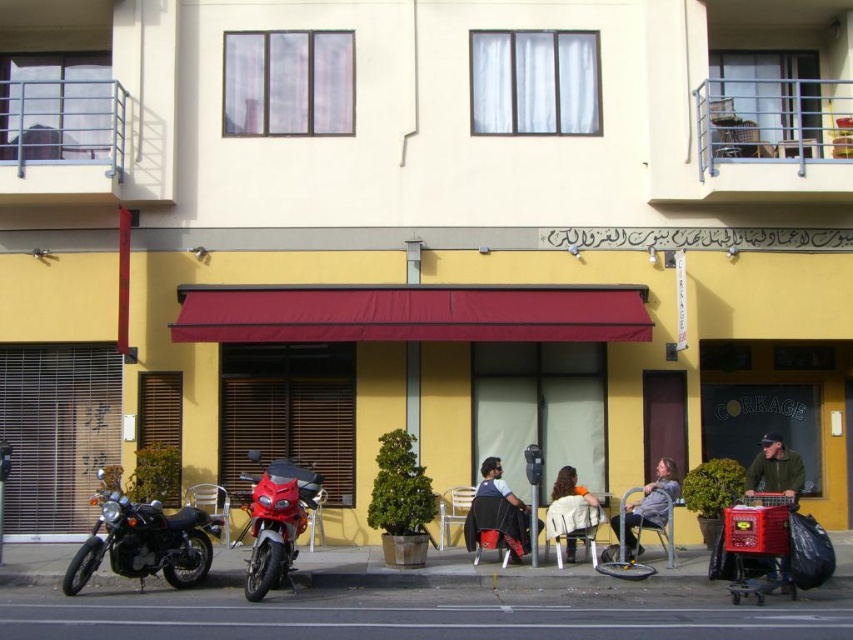
Question: Which point is closer to the camera?

Choices:
 (A) shiny red motorcycle at lower left
 (B) light brown leather jacket at center
 (C) matte black jacket at center
 (D) black matte motorcycle at lower left

Answer: (A)

Question: Which point is farther from the camera taking this photo?

Choices:
 (A) (170, 556)
 (B) (592, 528)
 (C) (468, 545)
 (D) (659, 506)

Answer: (D)

Question: Where is black matte motorcycle at lower left located in relation to green fabric jacket at lower right in the image?

Choices:
 (A) below
 (B) above

Answer: (A)

Question: Can you confirm if matte black jacket at center is positioned above light brown leather jacket at center?

Choices:
 (A) no
 (B) yes

Answer: (A)

Question: Can you confirm if shiny red motorcycle at lower left is positioned above light brown leather jacket at center?

Choices:
 (A) no
 (B) yes

Answer: (A)

Question: Which object appears closest to the camera in this image?

Choices:
 (A) light brown leather jacket at center
 (B) black matte motorcycle at lower left

Answer: (B)